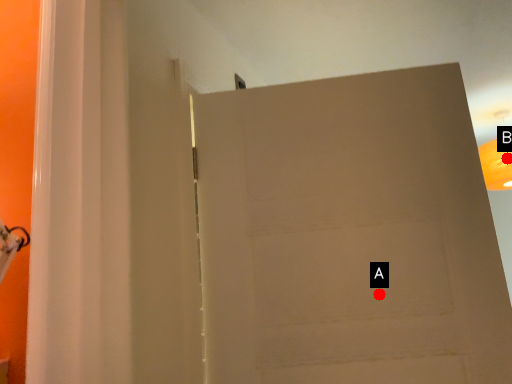
Question: Two points are circled on the image, labeled by A and B beside each circle. Which point is closer to the camera?

Choices:
 (A) A is closer
 (B) B is closer

Answer: (A)